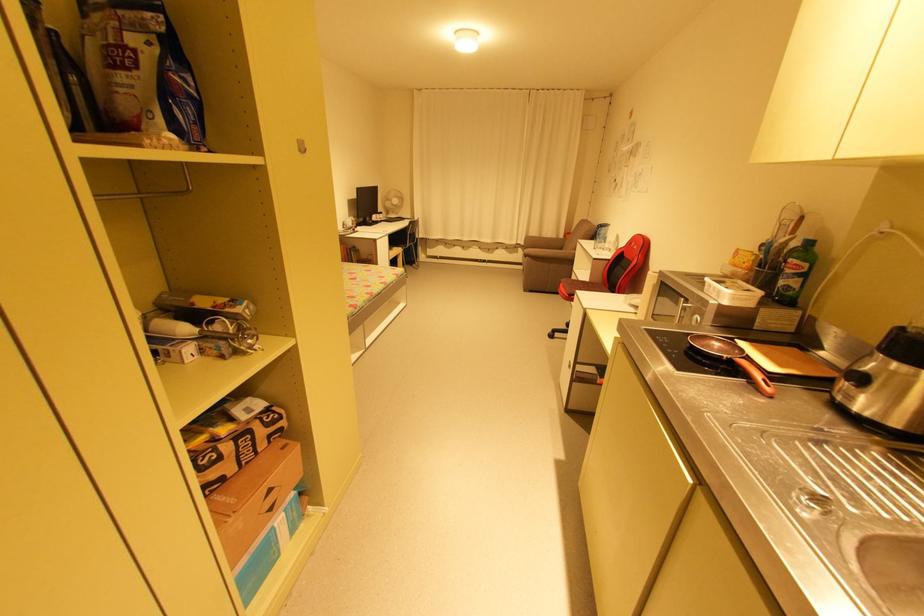
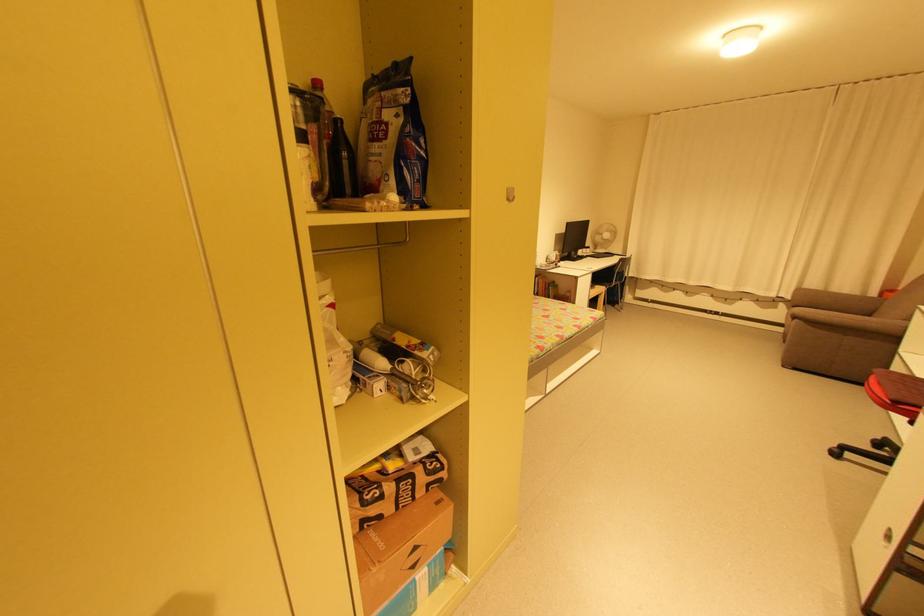
In the second image, find the point that corresponds to point (132, 70) in the first image.

(383, 140)